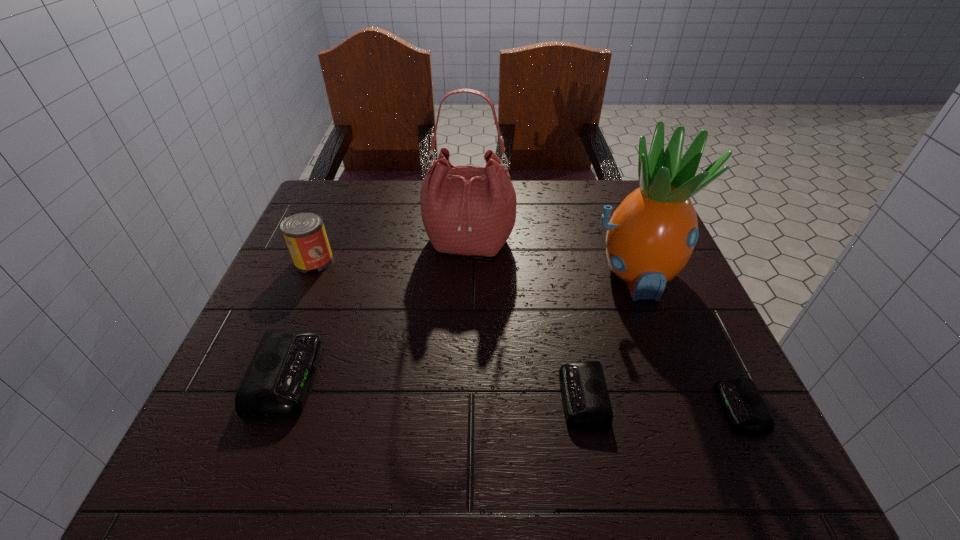
Find the location of `free area in between the fourth object from left to right and the pineapple`. free area in between the fourth object from left to right and the pineapple is located at coordinates (x=609, y=336).

Where is `vacant area that lies between the handbag and the rightmost alarm clock`? vacant area that lies between the handbag and the rightmost alarm clock is located at coordinates (605, 325).

Locate an element on the screen. unoccupied area between the second alarm clock from left to right and the shortest alarm clock is located at coordinates (661, 402).

Select which object appears as the fourth closest to the third tallest object. Please provide its 2D coordinates. Your answer should be formatted as a tuple, i.e. [(x, y)], where the tuple contains the x and y coordinates of a point satisfying the conditions above.

[(650, 237)]

Locate which object ranks in proximity to the pineapple. Please provide its 2D coordinates. Your answer should be formatted as a tuple, i.e. [(x, y)], where the tuple contains the x and y coordinates of a point satisfying the conditions above.

[(586, 401)]

Select which alarm clock is the closest to the fourth tallest object. Please provide its 2D coordinates. Your answer should be formatted as a tuple, i.e. [(x, y)], where the tuple contains the x and y coordinates of a point satisfying the conditions above.

[(586, 401)]

You are a GUI agent. You are given a task and a screenshot of the screen. Output one action in this format:
    pyautogui.click(x=<x>, y=<y>)
    Task: Click on the alarm clock that is the third closest to the third tallest object
    The width and height of the screenshot is (960, 540).
    Given the screenshot: What is the action you would take?
    pyautogui.click(x=742, y=402)

You are a GUI agent. You are given a task and a screenshot of the screen. Output one action in this format:
    pyautogui.click(x=<x>, y=<y>)
    Task: Click on the blank area in the image that satisfies the following two spatial constraints: 1. on the front side of the third object from left to right; 2. on the display of the third shortest object
    The image size is (960, 540).
    Given the screenshot: What is the action you would take?
    pyautogui.click(x=466, y=376)

What are the coordinates of `free point that satisfies the following two spatial constraints: 1. on the front side of the handbag; 2. on the display of the tallest alarm clock` in the screenshot? It's located at (466, 376).